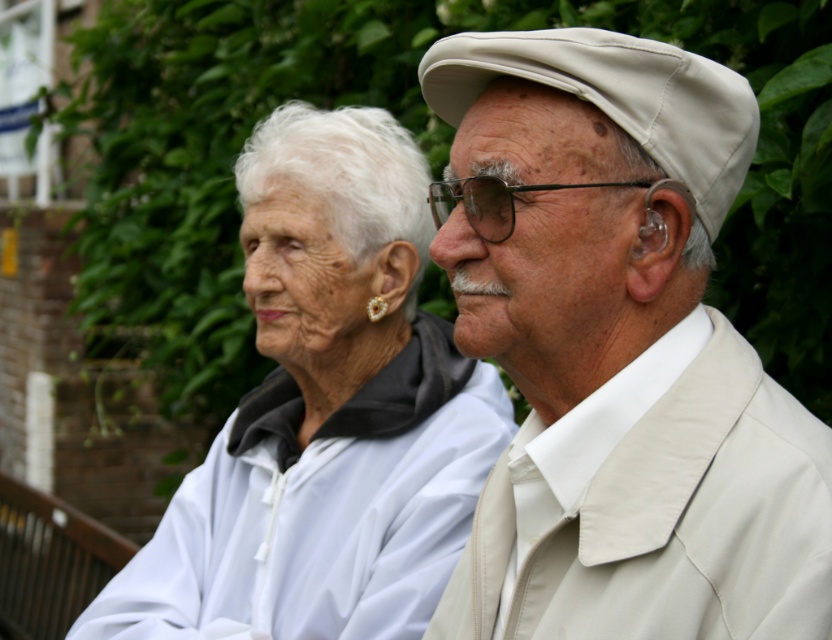
In the scene shown: Can you confirm if white matte jacket at center is positioned below black plastic goggles at center?

Yes, white matte jacket at center is below black plastic goggles at center.

Locate an element on the screen. This screenshot has height=640, width=832. white matte jacket at center is located at coordinates point(325,413).

Where is `white matte jacket at center`? The image size is (832, 640). white matte jacket at center is located at coordinates (325, 413).

Does beige fabric cap at upper right appear over black plastic goggles at center?

Incorrect, beige fabric cap at upper right is not positioned above black plastic goggles at center.

Which is below, beige fabric cap at upper right or black plastic goggles at center?

Positioned lower is beige fabric cap at upper right.

You are a GUI agent. You are given a task and a screenshot of the screen. Output one action in this format:
    pyautogui.click(x=<x>, y=<y>)
    Task: Click on the beige fabric cap at upper right
    
    Given the screenshot: What is the action you would take?
    pyautogui.click(x=617, y=349)

Does beige fabric cap at upper right have a larger size compared to white matte jacket at center?

No.

Can you confirm if beige fabric cap at upper right is smaller than white matte jacket at center?

Yes.

The height and width of the screenshot is (640, 832). I want to click on beige fabric cap at upper right, so click(617, 349).

Where is `beige fabric cap at upper right`? This screenshot has height=640, width=832. beige fabric cap at upper right is located at coordinates (617, 349).